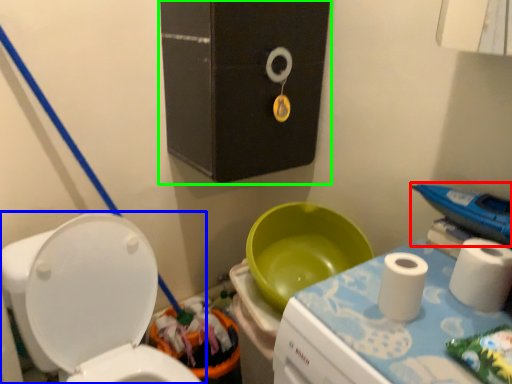
Question: Which object is positioned closest to appliance (highlighted by a red box)? Select from toilet (highlighted by a blue box) and medicine cabinet (highlighted by a green box).

Choices:
 (A) toilet
 (B) medicine cabinet

Answer: (B)